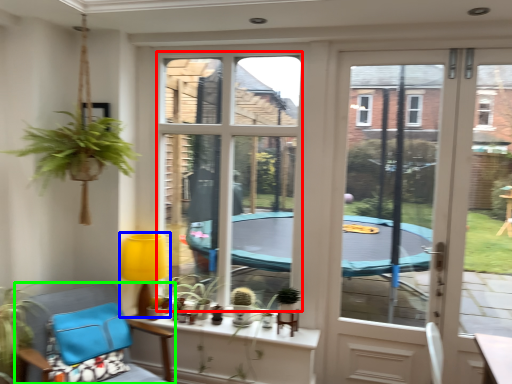
Question: Which is nearer to the window screen (highlighted by a red box)? lamp (highlighted by a blue box) or chair (highlighted by a green box).

Choices:
 (A) lamp
 (B) chair

Answer: (A)